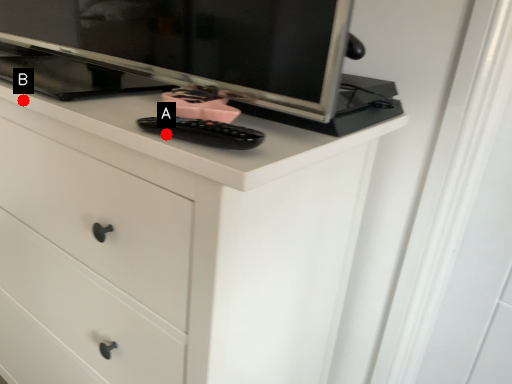
Question: Two points are circled on the image, labeled by A and B beside each circle. Which point is closer to the camera taking this photo?

Choices:
 (A) A is closer
 (B) B is closer

Answer: (A)